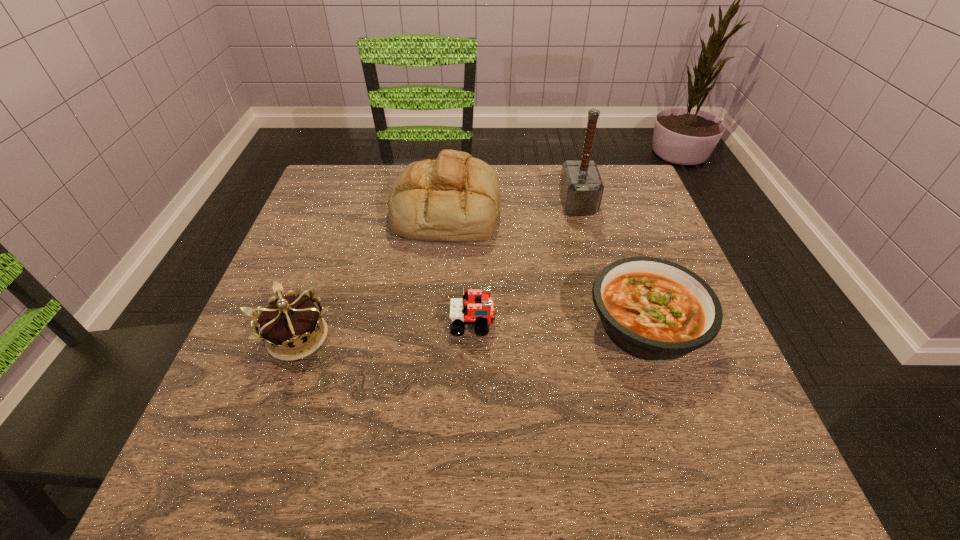
The image size is (960, 540). What are the coordinates of `vacant space at the right edge of the desktop` in the screenshot? It's located at (629, 242).

You are a GUI agent. You are given a task and a screenshot of the screen. Output one action in this format:
    pyautogui.click(x=<x>, y=<y>)
    Task: Click on the free point at the far left corner
    The height and width of the screenshot is (540, 960).
    Given the screenshot: What is the action you would take?
    pyautogui.click(x=332, y=195)

Identify the location of free space between the leftmost object and the stew. (471, 332).

Locate an element on the screen. free space between the stew and the leftmost object is located at coordinates (471, 332).

Find the location of a particular element. free spot between the stew and the bread is located at coordinates (545, 267).

Locate an element on the screen. The image size is (960, 540). vacant space in between the stew and the crown is located at coordinates (471, 332).

This screenshot has height=540, width=960. Identify the location of unoccupied area between the fourth shortest object and the Lego. (460, 266).

The height and width of the screenshot is (540, 960). In order to click on blank region between the Lego and the crown in this screenshot , I will do `click(385, 330)`.

Locate an element on the screen. Image resolution: width=960 pixels, height=540 pixels. empty space that is in between the Lego and the tallest object is located at coordinates (525, 263).

At what (x,y) coordinates should I click in order to perform the action: click on vacant space that is in between the bread and the stew. Please return your answer as a coordinate pair (x, y). This screenshot has height=540, width=960. Looking at the image, I should click on (545, 267).